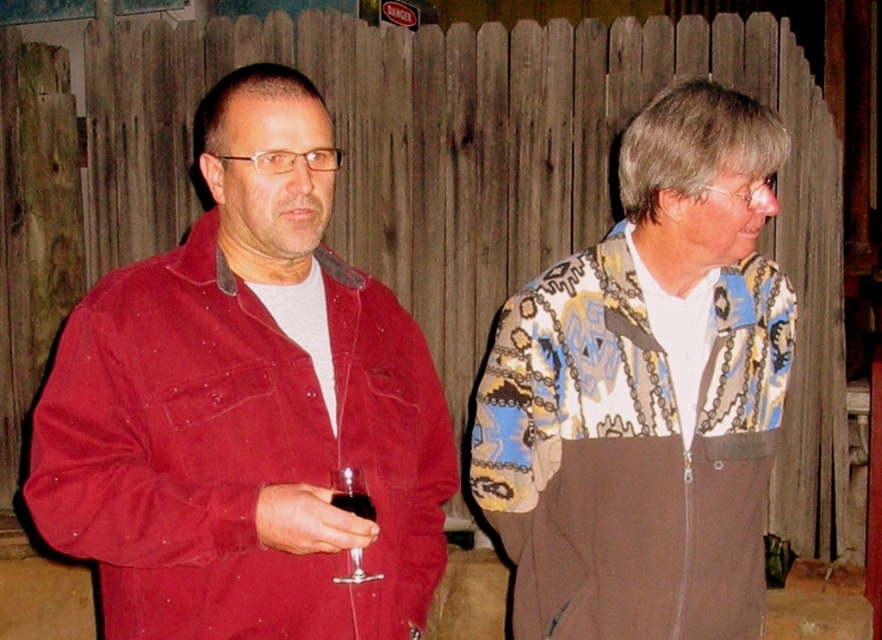
Can you confirm if matte red jacket at left is smaller than transparent glass at lower left?

No, matte red jacket at left is not smaller than transparent glass at lower left.

Does matte red jacket at left appear on the left side of transparent glass at lower left?

Correct, you'll find matte red jacket at left to the left of transparent glass at lower left.

Who is more forward, (270, 227) or (382, 577)?

Point (270, 227) is more forward.

Where is `matte red jacket at left`? This screenshot has width=882, height=640. matte red jacket at left is located at coordinates [x=245, y=406].

Between point (738, 262) and point (354, 477), which one is positioned in front?

Point (354, 477)

The image size is (882, 640). Find the location of `printed fabric jacket at right`. printed fabric jacket at right is located at coordinates (647, 392).

Is point (731, 404) farther from viewer compared to point (350, 476)?

That is True.

Locate an element on the screen. The height and width of the screenshot is (640, 882). printed fabric jacket at right is located at coordinates (647, 392).

Is point (289, 228) positioned behind point (748, 120)?

No, (289, 228) is closer to viewer.

Measure the distance from matte red jacket at left to printed fabric jacket at right.

They are 16.42 inches apart.

Is point (273, 163) farther from viewer compared to point (733, 394)?

No, it is in front of (733, 394).

At what (x,y) coordinates should I click in order to perform the action: click on matte red jacket at left. Please return your answer as a coordinate pair (x, y). The height and width of the screenshot is (640, 882). Looking at the image, I should click on (245, 406).